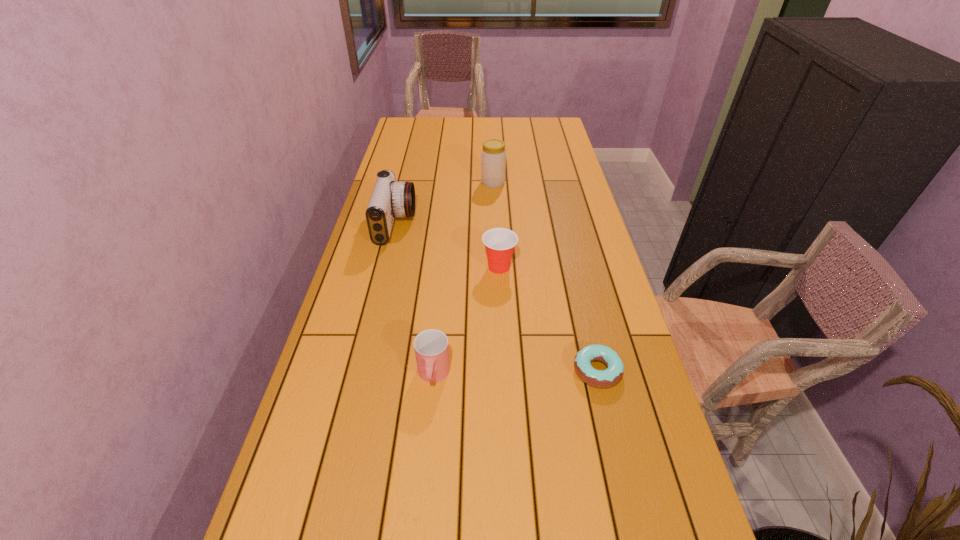
I want to click on vacant region at the far right corner of the desktop, so click(545, 136).

Where is `vacant area that lies between the left cup and the jar`? vacant area that lies between the left cup and the jar is located at coordinates (463, 279).

This screenshot has height=540, width=960. Identify the location of vacant area between the farther cup and the jar. pyautogui.click(x=496, y=225).

This screenshot has width=960, height=540. I want to click on empty space between the fourth object from right to left and the shortest object, so click(516, 373).

This screenshot has height=540, width=960. What are the coordinates of `free space between the nearer cup and the shortest object` in the screenshot? It's located at (516, 373).

The width and height of the screenshot is (960, 540). I want to click on vacant space that is in between the farthest object and the second object from left to right, so click(x=463, y=279).

Find the location of a particular element. free point between the right cup and the leftmost object is located at coordinates (447, 246).

You are a GUI agent. You are given a task and a screenshot of the screen. Output one action in this format:
    pyautogui.click(x=<x>, y=<y>)
    Task: Click on the free space between the right cup and the farthest object
    The image size is (960, 540).
    Given the screenshot: What is the action you would take?
    pyautogui.click(x=496, y=225)

In order to click on free space between the doughnut and the right cup in this screenshot , I will do `click(548, 319)`.

Identify the location of empty location between the nearer cup and the jar. (463, 279).